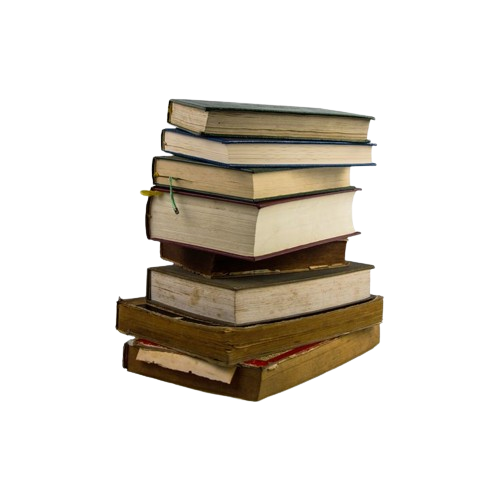
I want to click on book, so click(250, 378), click(231, 348), click(237, 301), click(225, 259), click(238, 231), click(247, 180), click(262, 144), click(278, 119).